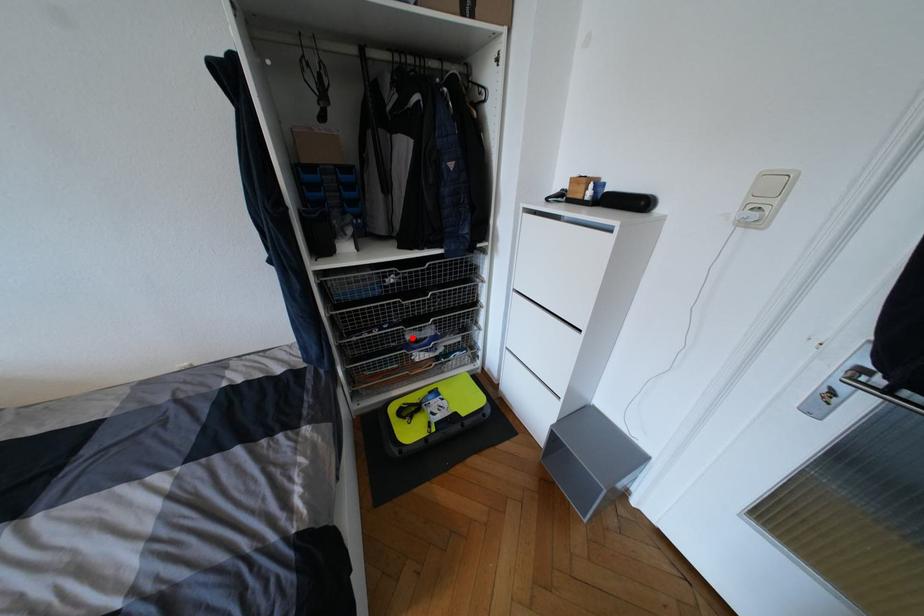
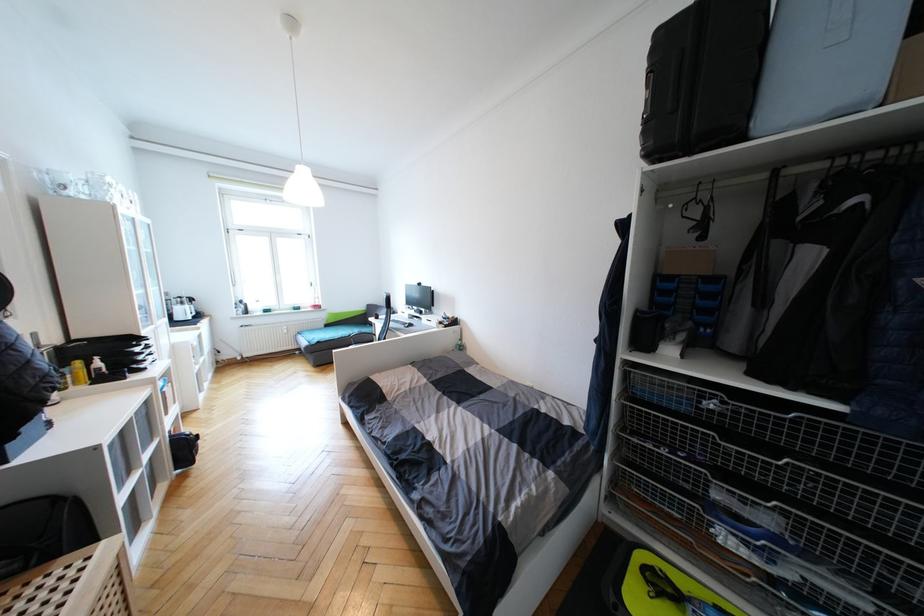
The point at the highlighted location is marked in the first image. Where is the corresponding point in the second image?

(720, 496)